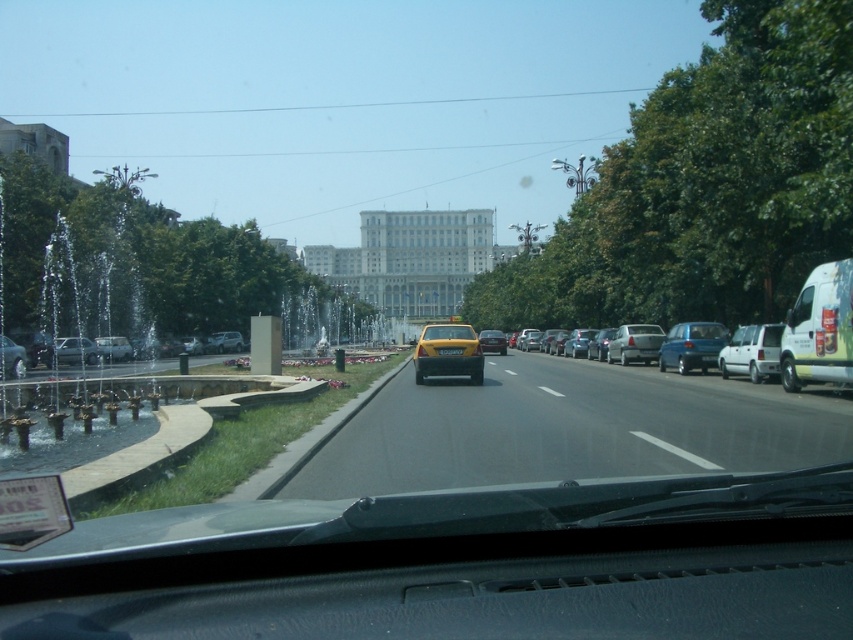
Who is shorter, matte silver sedan at center-left or yellow plastic license plate at center?

Standing shorter between the two is yellow plastic license plate at center.

Does matte silver sedan at center-left come behind yellow plastic license plate at center?

Yes, matte silver sedan at center-left is further from the viewer.

Between point (219, 333) and point (439, 349), which one is positioned in front?

Point (439, 349) is in front.

Locate an element on the screen. The image size is (853, 640). matte silver sedan at center-left is located at coordinates click(224, 342).

Is yellow matte taxi at center below yellow plastic taxi at center?

Correct, yellow matte taxi at center is located below yellow plastic taxi at center.

Does yellow matte taxi at center come in front of yellow plastic taxi at center?

Yes, it is in front of yellow plastic taxi at center.

In order to click on yellow matte taxi at center in this screenshot , I will do `click(448, 353)`.

Can you confirm if silver metallic sedan at center right is smaller than yellow plastic license plate at center?

No, silver metallic sedan at center right is not smaller than yellow plastic license plate at center.

Is silver metallic sedan at center right above yellow plastic license plate at center?

Yes.

Image resolution: width=853 pixels, height=640 pixels. Describe the element at coordinates (722, 349) in the screenshot. I see `silver metallic sedan at center right` at that location.

I want to click on silver metallic sedan at center right, so click(722, 349).